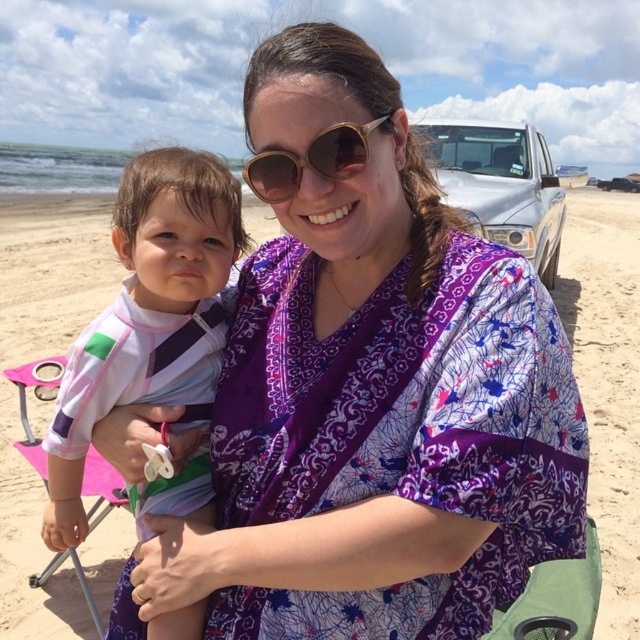
Does beige sand at center have a smaller size compared to gold metallic sunglasses at center?

Incorrect, beige sand at center is not smaller in size than gold metallic sunglasses at center.

Who is taller, beige sand at center or gold metallic sunglasses at center?

beige sand at center

Who is more distant from viewer, (620, 276) or (346, 157)?

The point (620, 276) is behind.

In order to click on beige sand at center in this screenshot , I will do `click(36, 358)`.

Who is positioned more to the right, white striped rash guard at center or gold metallic sunglasses at center?

Positioned to the right is gold metallic sunglasses at center.

What do you see at coordinates (148, 314) in the screenshot? I see `white striped rash guard at center` at bounding box center [148, 314].

Who is more distant from viewer, (157, 308) or (326, 134)?

Positioned behind is point (157, 308).

I want to click on white striped rash guard at center, so click(x=148, y=314).

Does beige sand at center have a lesser width compared to white striped rash guard at center?

Incorrect, beige sand at center's width is not less than white striped rash guard at center's.

This screenshot has height=640, width=640. Describe the element at coordinates (36, 358) in the screenshot. I see `beige sand at center` at that location.

Which is in front, point (16, 417) or point (160, 637)?

Point (160, 637) is more forward.

At what (x,y) coordinates should I click in order to perform the action: click on beige sand at center. Please return your answer as a coordinate pair (x, y). Image resolution: width=640 pixels, height=640 pixels. Looking at the image, I should click on (36, 358).